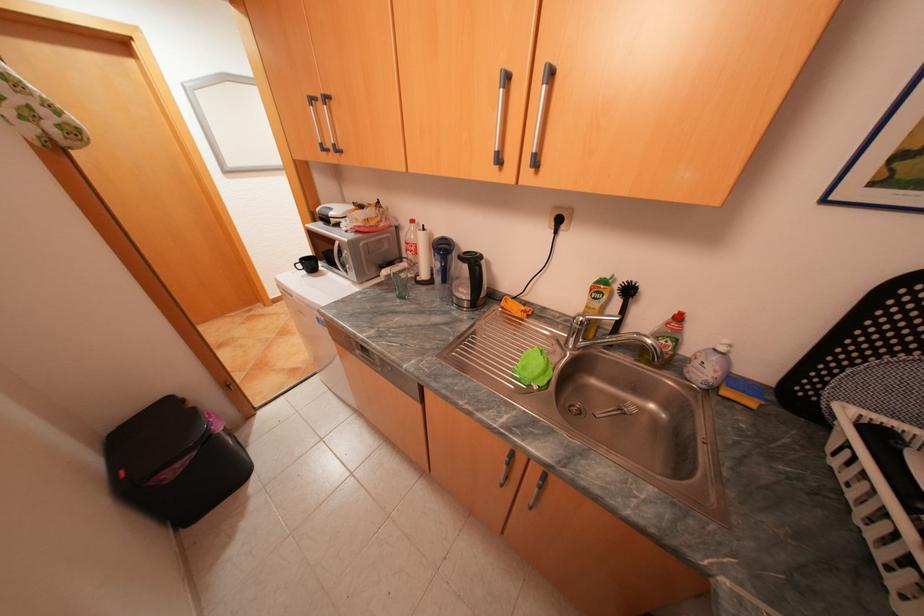
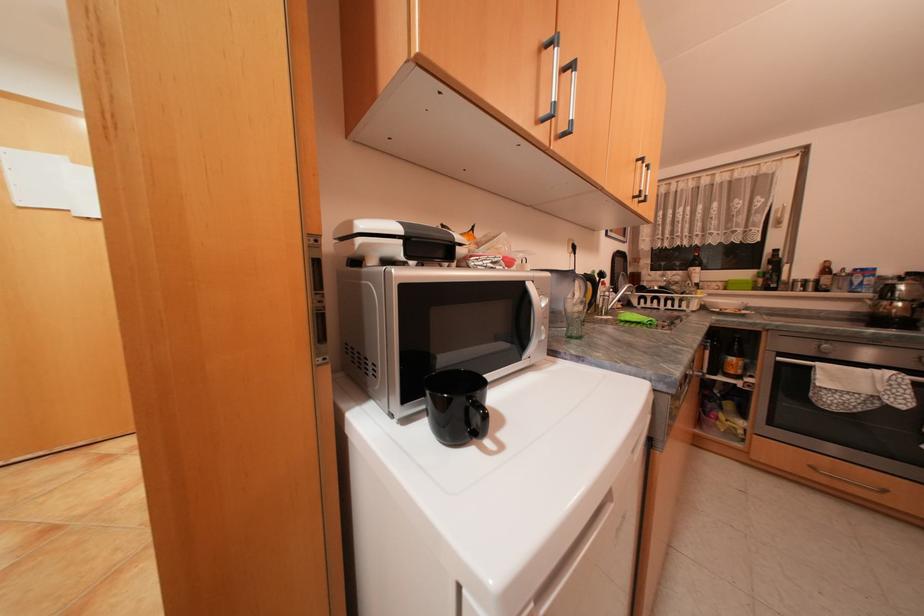
Where in the second image is the point corresponding to point 622,277 from the first image?

(602, 270)